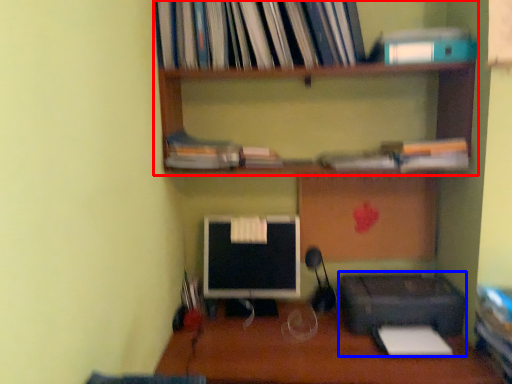
Question: Which of the following is the farthest to the observer, shelf (highlighted by a red box) or printer (highlighted by a blue box)?

Choices:
 (A) shelf
 (B) printer

Answer: (A)